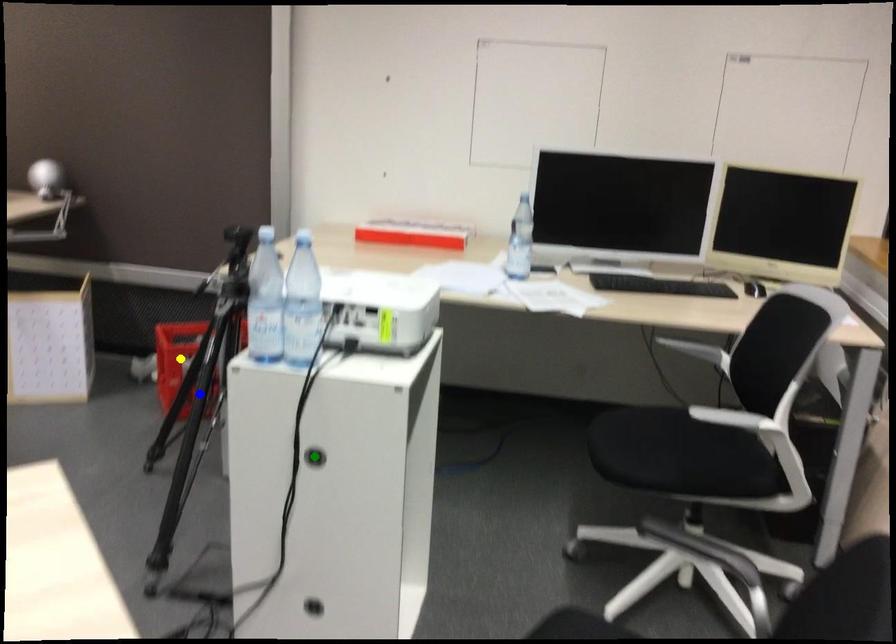
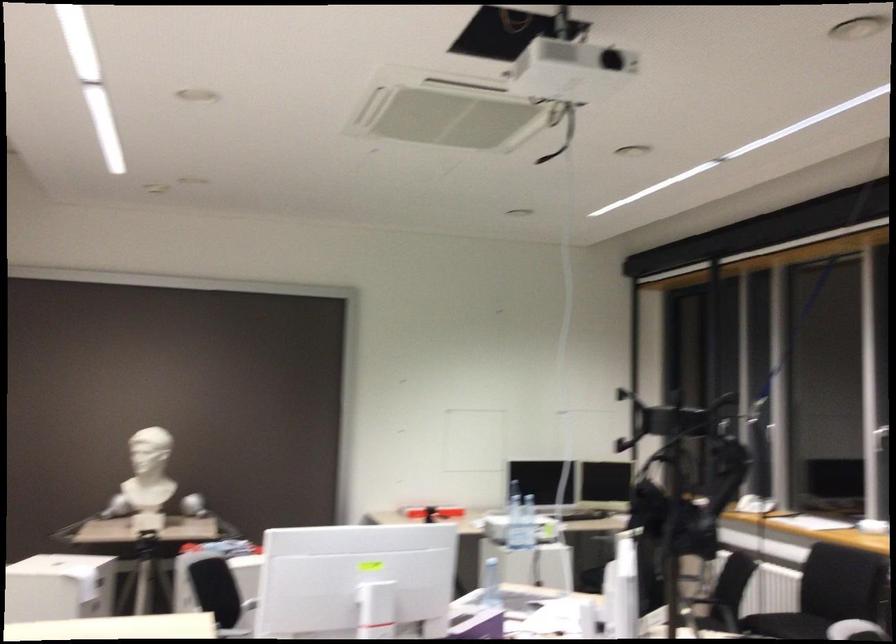
I am providing you with two images of the same scene from different viewpoints. Three points are marked in image1. Which point corresponds to a part or object that is occluded in image2?In image1, three points are marked. Which of them correspond to a part or object that is occluded in image2?Among the three points shown in image1, which one corresponds to a part or object that is no longer visible due to occlusion in image2?

Invisible in image2: green point, blue point, yellow point.